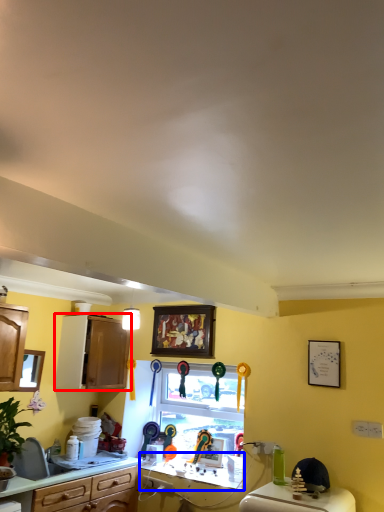
Question: Which object is further to the camera taking this photo, cabinetry (highlighted by a red box) or counter top (highlighted by a blue box)?

Choices:
 (A) cabinetry
 (B) counter top

Answer: (A)